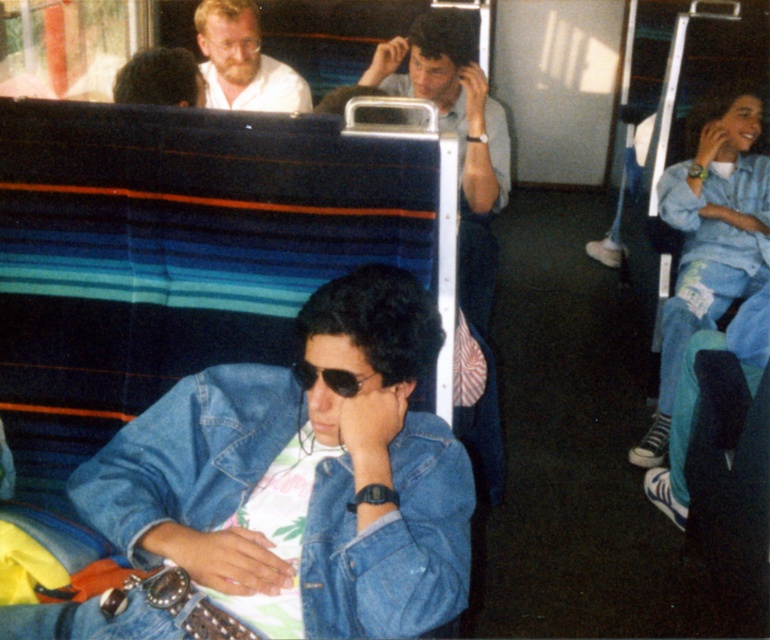
Question: Where is faded denim jacket at lower right located in relation to bearded man at upper left in the image?

Choices:
 (A) below
 (B) above

Answer: (A)

Question: Does faded denim jacket at lower right have a lesser width compared to bearded man at upper left?

Choices:
 (A) yes
 (B) no

Answer: (B)

Question: Is faded denim jacket at lower right further to camera compared to denim jacket at upper right?

Choices:
 (A) no
 (B) yes

Answer: (A)

Question: Which object is closer to the camera taking this photo?

Choices:
 (A) faded denim jacket at lower right
 (B) denim jacket at upper right
 (C) bearded man at upper left

Answer: (A)

Question: Which is nearer to the denim jacket at upper right?

Choices:
 (A) faded denim jacket at lower right
 (B) bearded man at upper left

Answer: (B)

Question: Which point appears closest to the camera in this image?

Choices:
 (A) click(x=308, y=88)
 (B) click(x=717, y=176)
 (C) click(x=390, y=554)

Answer: (C)